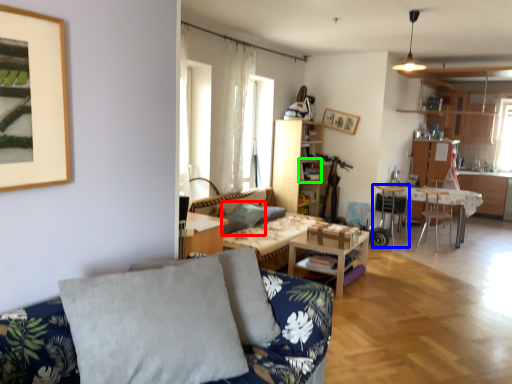
Question: Based on their relative distances, which object is farther from pillow (highlighted by a red box)? Choose from chair (highlighted by a blue box) and shelf (highlighted by a green box).

Choices:
 (A) chair
 (B) shelf

Answer: (A)